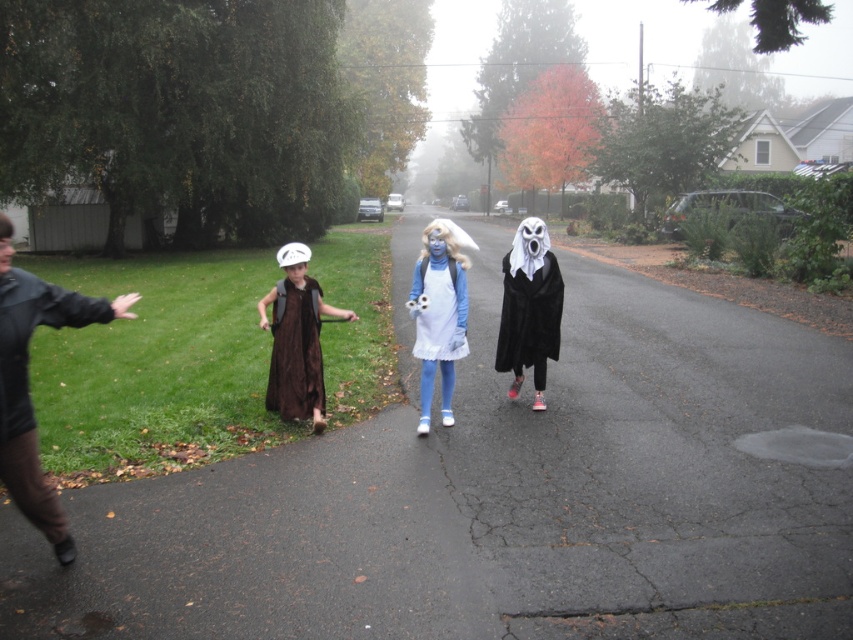
Is point (283, 360) closer to camera compared to point (538, 234)?

Yes, it is.

Consider the image. Is brown matte dress at center shorter than white matte ghost at center?

Correct, brown matte dress at center is not as tall as white matte ghost at center.

The width and height of the screenshot is (853, 640). What are the coordinates of `brown matte dress at center` in the screenshot? It's located at (296, 339).

At what (x,y) coordinates should I click in order to perform the action: click on brown matte dress at center. Please return your answer as a coordinate pair (x, y). Looking at the image, I should click on (296, 339).

Can you confirm if brown matte dress at center is bigger than brown velvet vest at center?

Correct, brown matte dress at center is larger in size than brown velvet vest at center.

Between point (277, 408) and point (279, 401), which one is positioned in front?

Point (279, 401)

Between point (299, 416) and point (315, 301), which one is positioned in front?

Point (299, 416) is more forward.

Locate an element on the screen. brown matte dress at center is located at coordinates (296, 339).

Measure the distance between dark brown leather jacket at left and camera.

12.00 feet

In the scene shown: Who is more forward, (3, 371) or (285, 413)?

Positioned in front is point (3, 371).

What do you see at coordinates (27, 381) in the screenshot? This screenshot has width=853, height=640. I see `dark brown leather jacket at left` at bounding box center [27, 381].

You are a GUI agent. You are given a task and a screenshot of the screen. Output one action in this format:
    pyautogui.click(x=<x>, y=<y>)
    Task: Click on the dark brown leather jacket at left
    The image size is (853, 640).
    Given the screenshot: What is the action you would take?
    pyautogui.click(x=27, y=381)